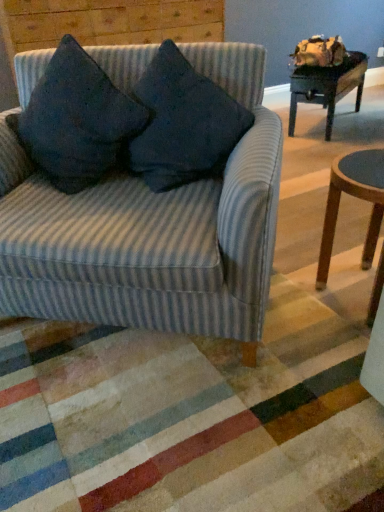
Where is `vacant space to the left of wooden round stool at lower right`? The image size is (384, 512). vacant space to the left of wooden round stool at lower right is located at coordinates (292, 309).